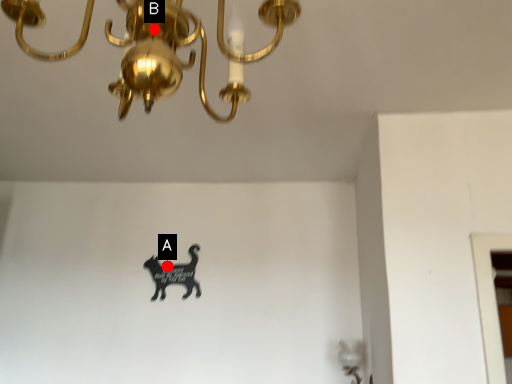
Question: Two points are circled on the image, labeled by A and B beside each circle. Among these points, which one is nearest to the camera?

Choices:
 (A) A is closer
 (B) B is closer

Answer: (B)